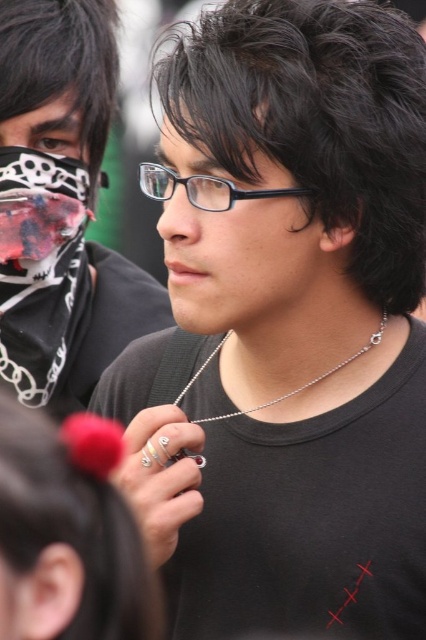
Between matte black mask at upper left and black plastic glasses at center, which one appears on the right side from the viewer's perspective?

black plastic glasses at center is more to the right.

Who is more distant from viewer, (19, 128) or (158, 195)?

Positioned behind is point (19, 128).

Locate an element on the screen. This screenshot has height=640, width=426. matte black mask at upper left is located at coordinates (48, 129).

Can you confirm if black matte hair at center is positioned to the right of silver chain necklace at center?

Yes, black matte hair at center is to the right of silver chain necklace at center.

Between black matte hair at center and silver chain necklace at center, which one is positioned lower?

Positioned lower is silver chain necklace at center.

This screenshot has height=640, width=426. Identify the location of black matte hair at center. (316, 120).

Image resolution: width=426 pixels, height=640 pixels. I want to click on matte black shirt at center, so click(x=60, y=205).

What do you see at coordinates (60, 205) in the screenshot? The height and width of the screenshot is (640, 426). I see `matte black shirt at center` at bounding box center [60, 205].

Who is more distant from viewer, (8, 248) or (166, 192)?

Point (8, 248)

The image size is (426, 640). In order to click on matte black shirt at center in this screenshot , I will do `click(60, 205)`.